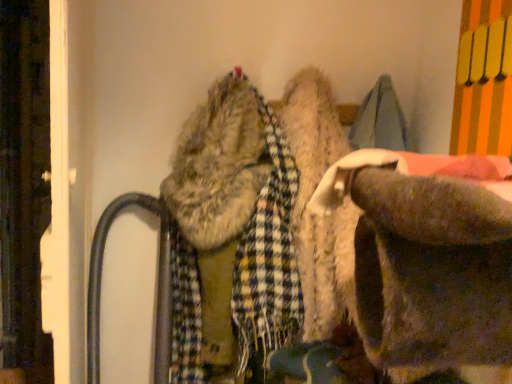
Question: Should I look upward or downward to see wooden door at left?

Choices:
 (A) up
 (B) down

Answer: (B)